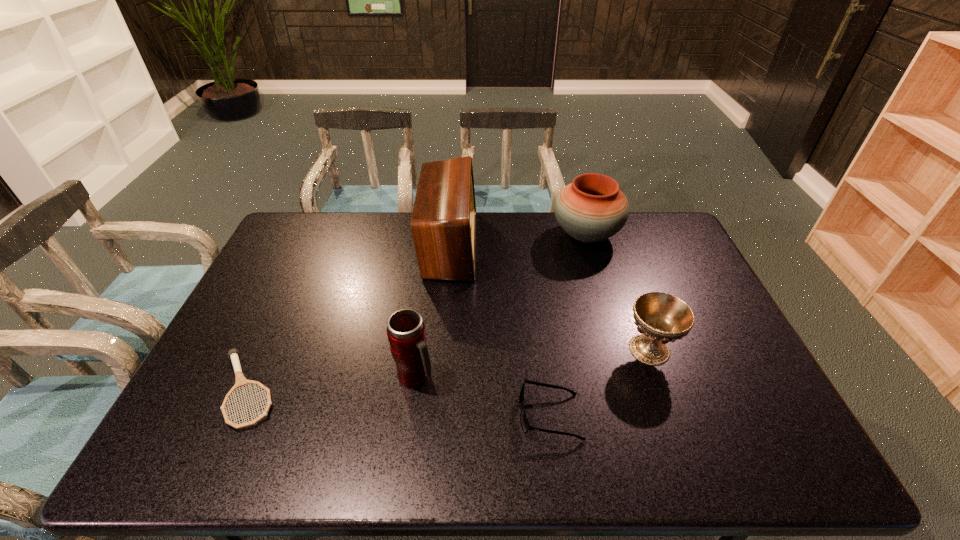
Identify the location of vacant point located between the thermos bottle and the shortest object. (331, 383).

Locate an element on the screen. free space between the sunglasses and the shortest object is located at coordinates (398, 402).

Where is `vacant space in between the thermos bottle and the radio receiver`? vacant space in between the thermos bottle and the radio receiver is located at coordinates click(433, 311).

At what (x,y) coordinates should I click in order to perform the action: click on free space between the fourth tallest object and the radio receiver. Please return your answer as a coordinate pair (x, y). This screenshot has height=540, width=960. Looking at the image, I should click on (549, 297).

Identify which object is the second nearest to the pottery. Please provide its 2D coordinates. Your answer should be formatted as a tuple, i.e. [(x, y)], where the tuple contains the x and y coordinates of a point satisfying the conditions above.

[(660, 318)]

Identify which object is located as the second nearest to the tennis racket. Please provide its 2D coordinates. Your answer should be formatted as a tuple, i.e. [(x, y)], where the tuple contains the x and y coordinates of a point satisfying the conditions above.

[(443, 223)]

The height and width of the screenshot is (540, 960). In order to click on free spot that satisfies the following two spatial constraints: 1. on the front side of the pottery; 2. on the front-facing side of the fourth object from left to right in this screenshot , I will do `click(639, 415)`.

Where is `vacant position in the image that satisfies the following two spatial constraints: 1. on the back side of the pottery; 2. on the right side of the leftmost object`? vacant position in the image that satisfies the following two spatial constraints: 1. on the back side of the pottery; 2. on the right side of the leftmost object is located at coordinates (317, 235).

Identify the location of free region that satisfies the following two spatial constraints: 1. on the front side of the pottery; 2. on the side with the handle of the thermos bottle. The height and width of the screenshot is (540, 960). (628, 377).